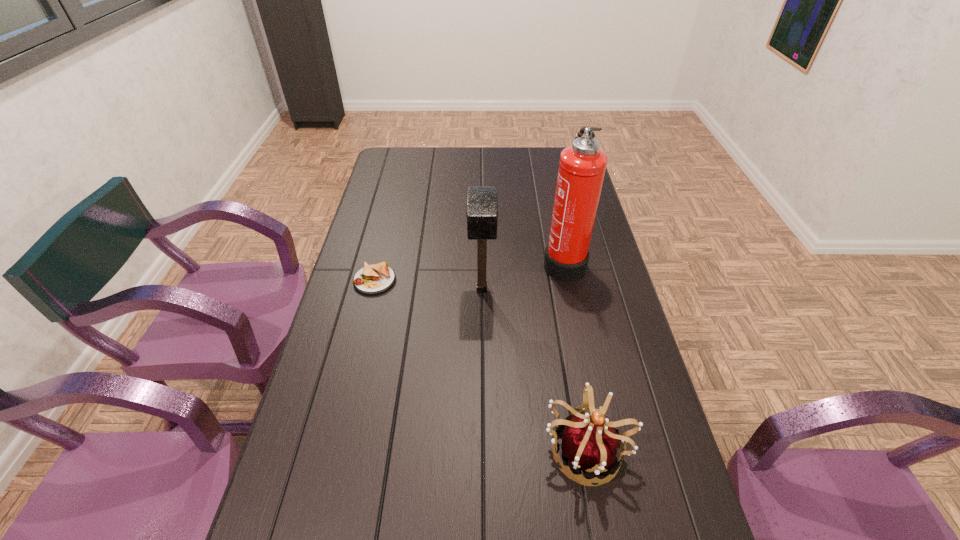
Locate an element on the screen. The width and height of the screenshot is (960, 540). unoccupied area between the tiara and the third object from right to left is located at coordinates 534,368.

You are a GUI agent. You are given a task and a screenshot of the screen. Output one action in this format:
    pyautogui.click(x=<x>, y=<y>)
    Task: Click on the vacant area that lies between the second tallest object and the third tallest object
    
    Given the screenshot: What is the action you would take?
    pyautogui.click(x=534, y=368)

Where is `vacant area that lies between the leftmost object and the fire extinguisher`? The height and width of the screenshot is (540, 960). vacant area that lies between the leftmost object and the fire extinguisher is located at coordinates (469, 271).

The image size is (960, 540). Find the location of `vacant space that's between the leftmost object and the tallest object`. vacant space that's between the leftmost object and the tallest object is located at coordinates 469,271.

Find the location of a particular element. Image resolution: width=960 pixels, height=540 pixels. vacant space that is in between the tallest object and the leftmost object is located at coordinates (469, 271).

Locate an element on the screen. This screenshot has height=540, width=960. unoccupied area between the second object from left to right and the tallest object is located at coordinates (522, 275).

Where is `empty space between the fire extinguisher and the shortest object`? The height and width of the screenshot is (540, 960). empty space between the fire extinguisher and the shortest object is located at coordinates tap(469, 271).

This screenshot has width=960, height=540. Identify the location of vacant area that lies between the sandwich and the tallest object. (469, 271).

I want to click on empty space that is in between the tallest object and the sandwich, so click(x=469, y=271).

Identify which object is the closest to the tiara. Please provide its 2D coordinates. Your answer should be formatted as a tuple, i.e. [(x, y)], where the tuple contains the x and y coordinates of a point satisfying the conditions above.

[(482, 203)]